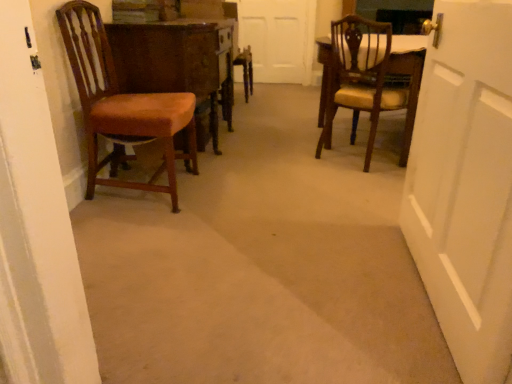
Find the location of a particular element. space that is in front of matte brown chair at left, which ranks as the 1th chair in left-to-right order is located at coordinates (148, 232).